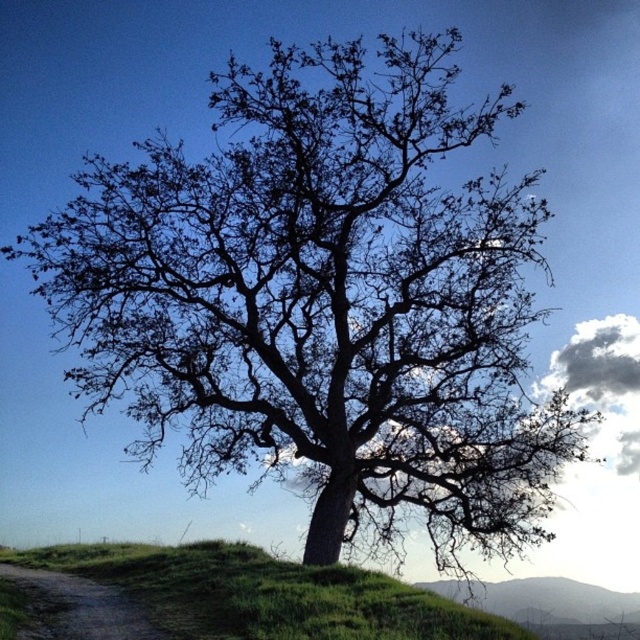
You are planning to set up a picnic area and have two options for locations on the green grassy hill at lower center and the green grassy hillside at lower right. Based on the scene description, which location offers more space for setting up your picnic?

The green grassy hillside at lower right offers more space for setting up the picnic because it occupies more area than the green grassy hill at lower center.